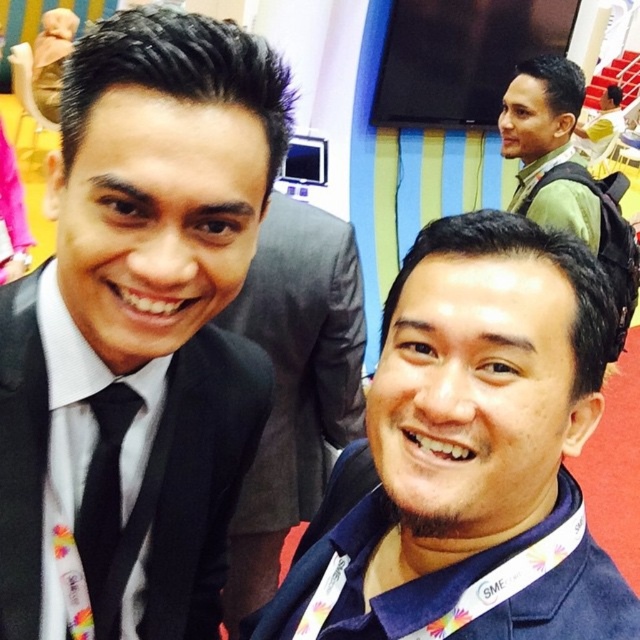
Who is positioned more to the right, matte black suit at left or green matte jacket at upper right?

Positioned to the right is green matte jacket at upper right.

Where is `matte black suit at left`? This screenshot has height=640, width=640. matte black suit at left is located at coordinates (173, 260).

Find the location of a particular element. This screenshot has height=640, width=640. matte black suit at left is located at coordinates (173, 260).

Does matte black suit at left have a greater width compared to black satin tie at left?

Indeed, matte black suit at left has a greater width compared to black satin tie at left.

What do you see at coordinates (173, 260) in the screenshot? I see `matte black suit at left` at bounding box center [173, 260].

Locate an element on the screen. The image size is (640, 640). matte black suit at left is located at coordinates (173, 260).

Is point (458, 401) positioned behind point (547, 161)?

No, it is in front of (547, 161).

Which is in front, point (435, 365) or point (568, 116)?

Point (435, 365) is in front.

Between point (467, 216) and point (566, 125), which one is positioned in front?

Positioned in front is point (467, 216).

Identify the location of blue fabric shirt at center. The height and width of the screenshot is (640, 640). (474, 452).